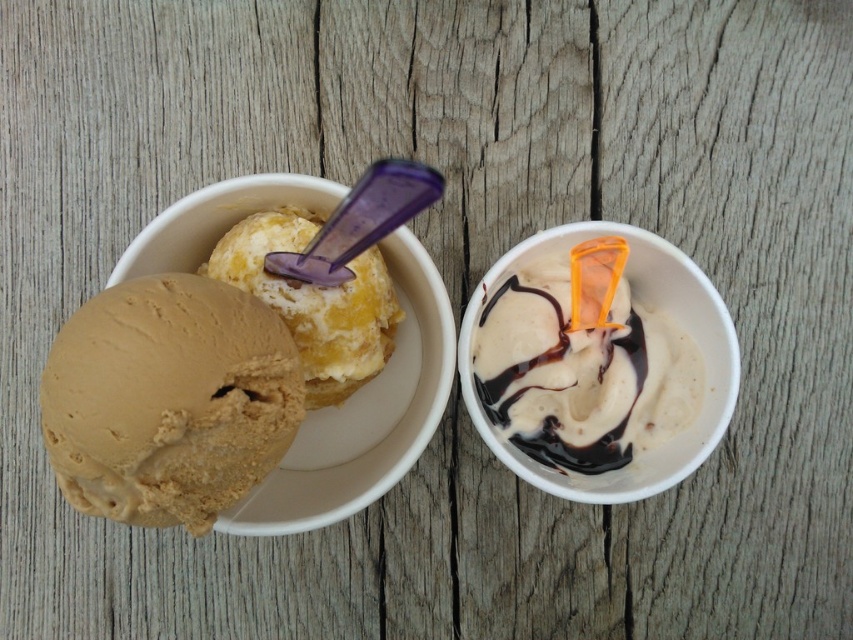
You have a matte plastic bowl at upper left and vanilla ice cream at upper left. Which one has a larger width?

The matte plastic bowl at upper left is wider than the vanilla ice cream at upper left.

You are at a dessert bar and see two ice cream bowls on a rustic wooden table. The golden brown ice cream at left and the white glossy ice cream at center are both in front of you. Which bowl is closer to you?

The golden brown ice cream at left is located below the white glossy ice cream at center, so the golden brown ice cream at left is closer to you.

You are standing in front of a rustic wooden table with two small white bowls. You want to grab the matte plastic bowl at upper left to taste its ice cream. Considering your arm can reach up to 1.1 meters, can you comfortably reach the bowl without moving your feet?

The matte plastic bowl at upper left is 1.04 meters away from the viewer. Since your arm can reach up to 1.1 meters, you can comfortably reach the bowl without moving your feet.